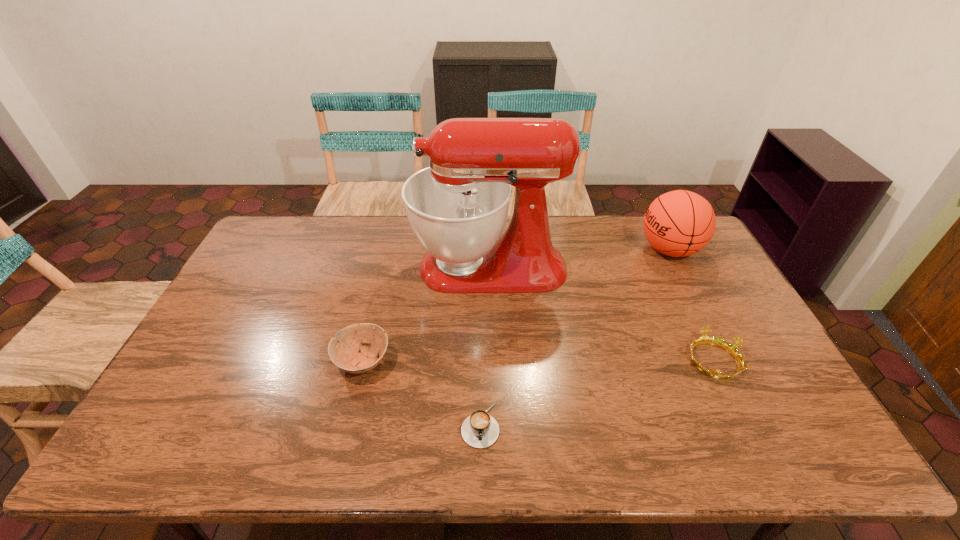
You are a GUI agent. You are given a task and a screenshot of the screen. Output one action in this format:
    pyautogui.click(x=<x>, y=<y>)
    Task: Click on the vacant area situated 0.170m on the side with logo of the second tallest object
    
    Given the screenshot: What is the action you would take?
    pyautogui.click(x=589, y=250)

You are a GUI agent. You are given a task and a screenshot of the screen. Output one action in this format:
    pyautogui.click(x=<x>, y=<y>)
    Task: Click on the vacant space located on the side with logo of the second tallest object
    
    Given the screenshot: What is the action you would take?
    pyautogui.click(x=607, y=250)

What are the coordinates of `free space located on the back of the leftmost object` in the screenshot? It's located at (388, 257).

Image resolution: width=960 pixels, height=540 pixels. I want to click on free space located 0.100m on the left of the crown, so click(x=649, y=360).

Find the location of a particular element. The image size is (960, 540). mixer present at the far edge is located at coordinates (457, 207).

I want to click on basketball at the far edge, so click(x=679, y=223).

Where is `object present at the near edge`? Image resolution: width=960 pixels, height=540 pixels. object present at the near edge is located at coordinates (480, 430).

Where is `basketball located at the right edge`? Image resolution: width=960 pixels, height=540 pixels. basketball located at the right edge is located at coordinates (679, 223).

In order to click on crown present at the right edge in this screenshot , I will do `click(704, 339)`.

Locate an element on the screen. The width and height of the screenshot is (960, 540). object located in the far right corner section of the desktop is located at coordinates (679, 223).